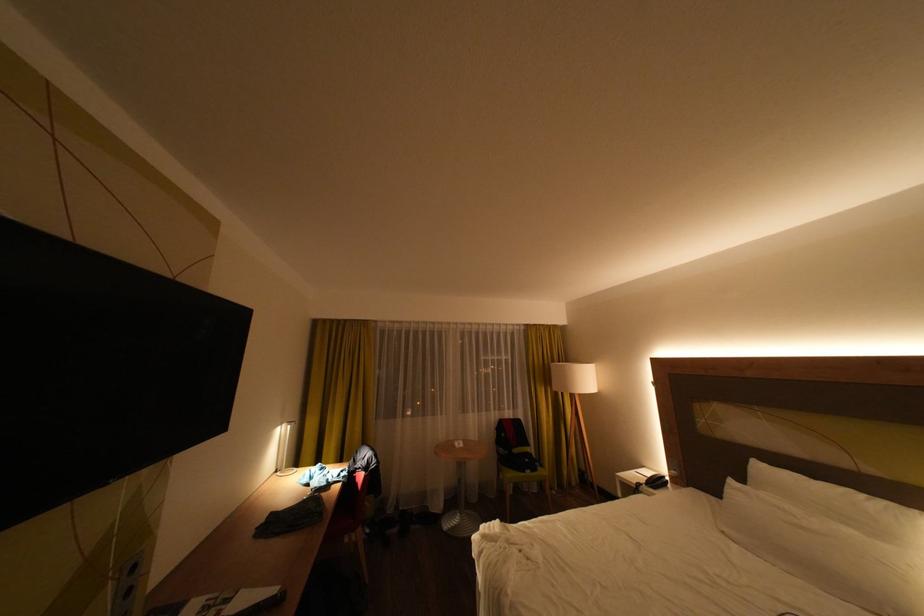
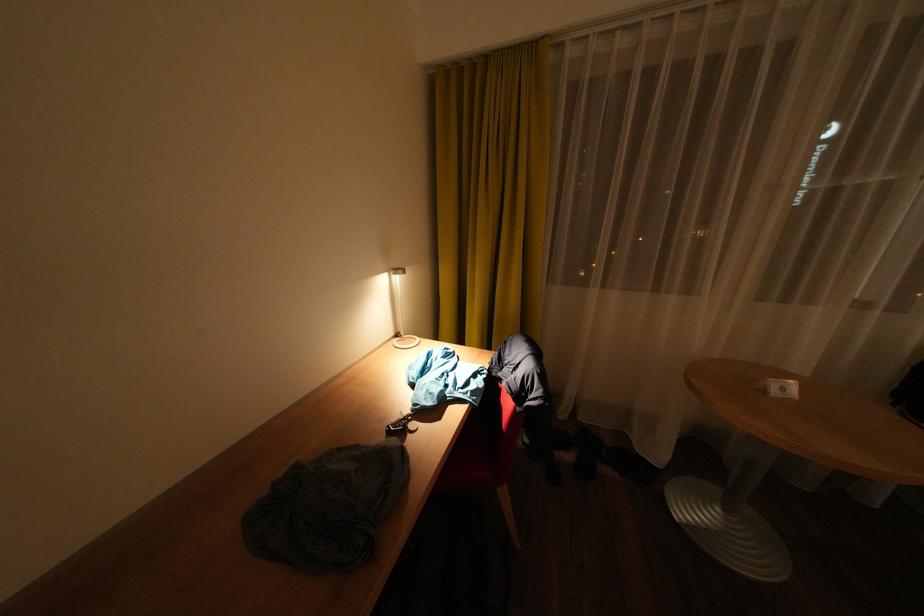
In the second image, find the point that corresponds to (469,445) in the first image.

(794, 390)